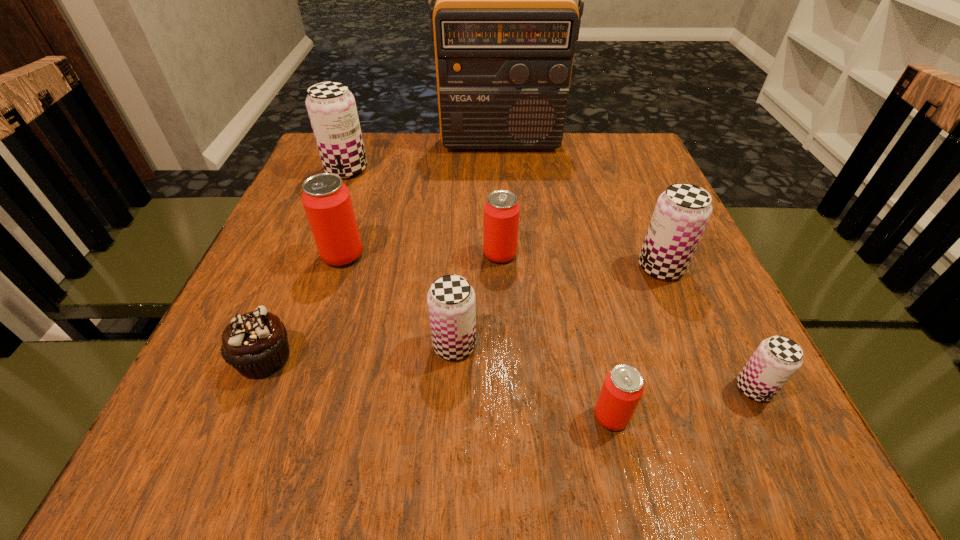
The height and width of the screenshot is (540, 960). Find the location of `free point that satisfies the following two spatial constraints: 1. on the front side of the biggest red beer can; 2. on the right side of the smallest red beer can`. free point that satisfies the following two spatial constraints: 1. on the front side of the biggest red beer can; 2. on the right side of the smallest red beer can is located at coordinates (290, 416).

I want to click on free location that satisfies the following two spatial constraints: 1. on the front side of the smallest purple beer can; 2. on the right side of the tallest beer can, so click(259, 388).

Where is `free space that satisfies the following two spatial constraints: 1. on the front side of the second farthest purple beer can; 2. on the left side of the smallest purple beer can`? The height and width of the screenshot is (540, 960). free space that satisfies the following two spatial constraints: 1. on the front side of the second farthest purple beer can; 2. on the left side of the smallest purple beer can is located at coordinates (711, 388).